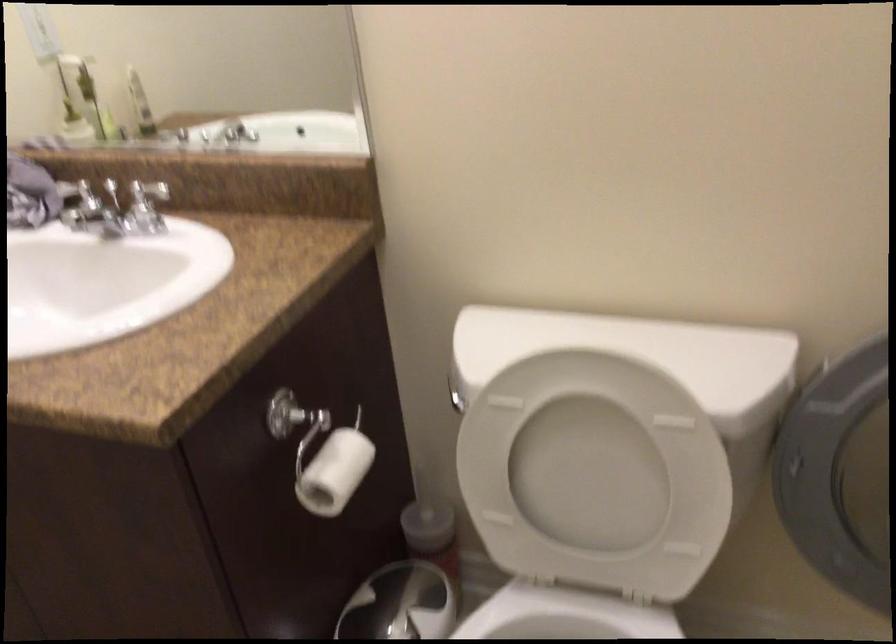
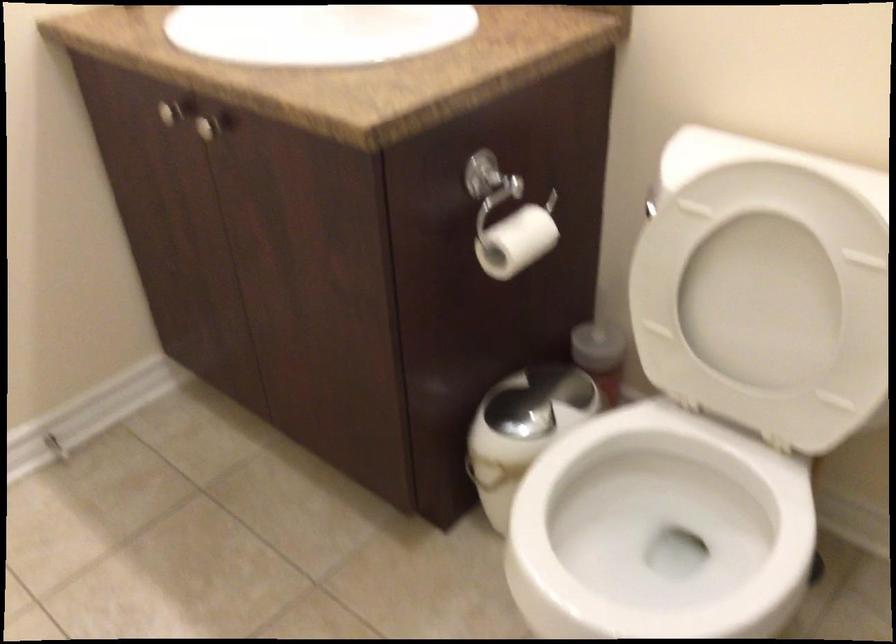
Locate, in the second image, the point that corresponds to [591,468] in the first image.

(763, 299)